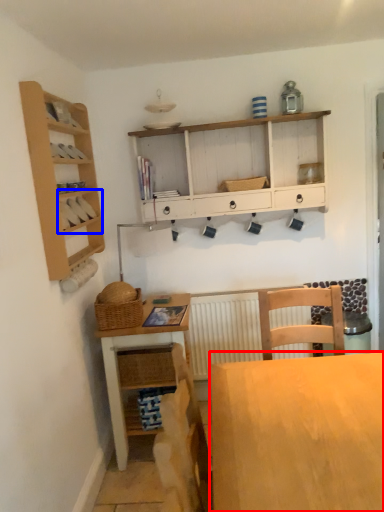
Question: Which of the following is the farthest to the observer, desk (highlighted by a red box) or cabinet (highlighted by a blue box)?

Choices:
 (A) desk
 (B) cabinet

Answer: (B)